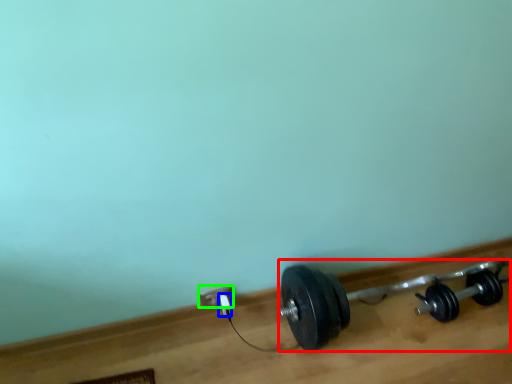
Question: Considering the real-world distances, which object is farthest from dumbbell (highlighted by a red box)? plug (highlighted by a blue box) or power plugs and sockets (highlighted by a green box)?

Choices:
 (A) plug
 (B) power plugs and sockets

Answer: (A)